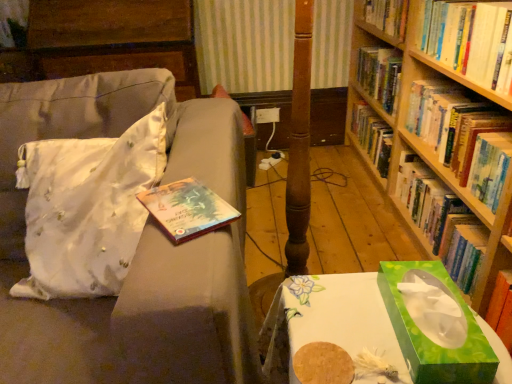
Describe the element at coordinates (463, 136) in the screenshot. I see `hardcover book at right, marked as the 2th book in a bottom-to-top arrangement` at that location.

What is the approximate height of hardcover book at upper right, the first book viewed from the top?

It is 8.18 inches.

In order to face white glossy table at lower right, should I rotate leftwards or rightwards?

Turn right approximately 13.287 degrees to face it.

Locate an element on the screen. Image resolution: width=512 pixels, height=384 pixels. hardcover book at upper right, acting as the 1th book starting from the bottom is located at coordinates (442, 221).

Identify the location of satin beige couch at left. click(137, 251).

You are a GUI agent. You are given a task and a screenshot of the screen. Output one action in this format:
    pyautogui.click(x=<x>, y=<y>)
    Task: Click on the green wooden bookcase at right
    The image size is (512, 384).
    Given the screenshot: What is the action you would take?
    pyautogui.click(x=442, y=137)

Find the location of a particular element. The width and height of the screenshot is (512, 384). hardcover book at right, marked as the 2th book in a bottom-to-top arrangement is located at coordinates (463, 136).

Which point is more forward, (505,61) or (212,138)?

The point (212,138) is more forward.

From the picture: Can you confirm if hardcover book at upper right, which is the third book in bottom-to-top order, is taller than satin beige couch at left?

No.

Is satin beige couch at left at the back of hardcover book at upper right, the first book viewed from the top?

That's not correct — hardcover book at upper right, the first book viewed from the top, is not looking away from satin beige couch at left.

From the image's perspective, between hardcover book at upper right, which is the third book in bottom-to-top order, and satin beige couch at left, who is located below?

satin beige couch at left appears lower in the image.

You are a GUI agent. You are given a task and a screenshot of the screen. Output one action in this format:
    pyautogui.click(x=<x>, y=<y>)
    Task: Click on the table above the hardcover book at upper right, acting as the 1th book starting from the bottom (from a real-world perspective)
    Image resolution: width=512 pixels, height=384 pixels.
    Given the screenshot: What is the action you would take?
    pyautogui.click(x=331, y=320)

Is white glossy table at lower right next to hardcover book at upper right, acting as the 1th book starting from the bottom, and touching it?

white glossy table at lower right and hardcover book at upper right, acting as the 1th book starting from the bottom, are clearly separated.

Who is more distant, white glossy table at lower right or hardcover book at upper right, acting as the 1th book starting from the bottom?

hardcover book at upper right, acting as the 1th book starting from the bottom.

Considering the relative positions of white glossy table at lower right and hardcover book at upper right, marked as the 3th book in a top-to-bottom arrangement, in the image provided, is white glossy table at lower right to the left of hardcover book at upper right, marked as the 3th book in a top-to-bottom arrangement, from the viewer's perspective?

Correct, you'll find white glossy table at lower right to the left of hardcover book at upper right, marked as the 3th book in a top-to-bottom arrangement.

Where is `throw pillow lying above the satin beige couch at left (from the image's perspective)`? Image resolution: width=512 pixels, height=384 pixels. throw pillow lying above the satin beige couch at left (from the image's perspective) is located at coordinates (87, 208).

From the image's perspective, which one is positioned higher, satin beige couch at left or white satin throw pillow at left?

white satin throw pillow at left is shown above in the image.

Is satin beige couch at left bigger or smaller than white satin throw pillow at left?

Clearly, satin beige couch at left is larger in size than white satin throw pillow at left.

Is green paper tissue box at lower right oriented towards hardcover book at upper right, acting as the 1th book starting from the bottom?

No, green paper tissue box at lower right is not turned towards hardcover book at upper right, acting as the 1th book starting from the bottom.

Consider the image. Which of these two, green paper tissue box at lower right or hardcover book at upper right, acting as the 1th book starting from the bottom, is wider?

With larger width is green paper tissue box at lower right.

Is hardcover book at upper right, acting as the 1th book starting from the bottom, a part of green paper tissue box at lower right?

No, hardcover book at upper right, acting as the 1th book starting from the bottom, is located outside of green paper tissue box at lower right.

How different are the orientations of green paper tissue box at lower right and hardcover book at upper right, marked as the 3th book in a top-to-bottom arrangement, in degrees?

The facing directions of green paper tissue box at lower right and hardcover book at upper right, marked as the 3th book in a top-to-bottom arrangement, are 87.9 degrees apart.

Are green wooden bookcase at right and white satin throw pillow at left beside each other?

green wooden bookcase at right and white satin throw pillow at left are clearly separated.

Is green wooden bookcase at right aimed at white satin throw pillow at left?

Yes, green wooden bookcase at right is oriented towards white satin throw pillow at left.

Is green wooden bookcase at right situated inside white satin throw pillow at left or outside?

green wooden bookcase at right is spatially situated outside white satin throw pillow at left.

At what (x,y) coordinates should I click in order to perform the action: click on table below the satin beige couch at left (from the image's perspective). Please return your answer as a coordinate pair (x, y). Image resolution: width=512 pixels, height=384 pixels. Looking at the image, I should click on (331, 320).

Is white glossy table at lower right next to satin beige couch at left and touching it?

No, white glossy table at lower right is not with satin beige couch at left.

From a real-world perspective, between white glossy table at lower right and satin beige couch at left, who is vertically lower?

In real-world perspective, white glossy table at lower right is lower.

From the image's perspective, is satin beige couch at left over hardcover book at upper right, marked as the 3th book in a top-to-bottom arrangement?

No, from the image's perspective, satin beige couch at left is not on top of hardcover book at upper right, marked as the 3th book in a top-to-bottom arrangement.

Consider the image. How different are the orientations of satin beige couch at left and hardcover book at upper right, marked as the 3th book in a top-to-bottom arrangement, in degrees?

satin beige couch at left and hardcover book at upper right, marked as the 3th book in a top-to-bottom arrangement, are facing 90.6 degrees away from each other.

Between satin beige couch at left and hardcover book at upper right, acting as the 1th book starting from the bottom, which one appears on the left side from the viewer's perspective?

satin beige couch at left is more to the left.

Looking at this image, is satin beige couch at left looking in the opposite direction of hardcover book at upper right, acting as the 1th book starting from the bottom?

satin beige couch at left is not turned away from hardcover book at upper right, acting as the 1th book starting from the bottom.

Locate an element on the screen. the 2nd book directly above the satin beige couch at left (from a real-world perspective) is located at coordinates (471, 40).

At what (x,y) coordinates should I click in order to perform the action: click on table that is below the hardcover book at upper right, marked as the 3th book in a top-to-bottom arrangement (from the image's perspective). Please return your answer as a coordinate pair (x, y). Looking at the image, I should click on (331, 320).

Looking at the image, which one is located closer to satin beige couch at left, white glossy table at lower right or hardcover book at upper right, acting as the 1th book starting from the bottom?

white glossy table at lower right is closer to satin beige couch at left.

When comparing their distances from satin beige couch at left, does white satin throw pillow at left or hardcover book at right, acting as the second book starting from the top, seem closer?

Based on the image, white satin throw pillow at left appears to be nearer to satin beige couch at left.

Looking at the image, which one is located closer to satin beige couch at left, hardcover book at right, acting as the second book starting from the top, or hardcover book at upper right, which is the third book in bottom-to-top order?

hardcover book at right, acting as the second book starting from the top, is closer to satin beige couch at left.

Estimate the real-world distances between objects in this image. Which object is further from hardcover book at upper right, acting as the 1th book starting from the bottom, hardcover book at upper right, which is the third book in bottom-to-top order, or satin beige couch at left?

satin beige couch at left.

When comparing their distances from satin beige couch at left, does green paper tissue box at lower right or white satin throw pillow at left seem further?

green paper tissue box at lower right.

Based on their spatial positions, is green wooden bookcase at right or white satin throw pillow at left closer to hardcover book at right, acting as the second book starting from the top?

Based on the image, green wooden bookcase at right appears to be nearer to hardcover book at right, acting as the second book starting from the top.

Considering their positions, is hardcover book at upper right, the first book viewed from the top, positioned closer to white satin throw pillow at left than green wooden bookcase at right?

Among the two, hardcover book at upper right, the first book viewed from the top, is located nearer to white satin throw pillow at left.

When comparing their distances from green wooden bookcase at right, does hardcover book at right, marked as the 2th book in a bottom-to-top arrangement, or white glossy table at lower right seem further?

white glossy table at lower right lies further to green wooden bookcase at right than the other object.

Locate an element on the screen. table between satin beige couch at left and hardcover book at upper right, which is the third book in bottom-to-top order, in the horizontal direction is located at coordinates (331, 320).

The image size is (512, 384). Identify the location of table located between satin beige couch at left and green wooden bookcase at right in the left-right direction. (331, 320).

This screenshot has width=512, height=384. In order to click on throw pillow located between satin beige couch at left and white glossy table at lower right in the left-right direction in this screenshot , I will do `click(87, 208)`.

This screenshot has height=384, width=512. What are the coordinates of `table located between white satin throw pillow at left and hardcover book at upper right, marked as the 3th book in a top-to-bottom arrangement, in the left-right direction` in the screenshot? It's located at (331, 320).